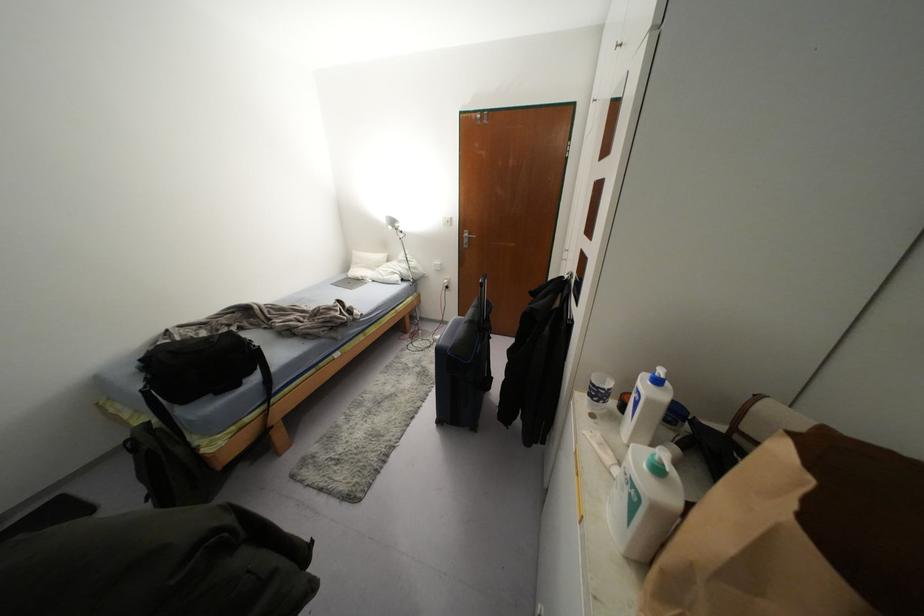
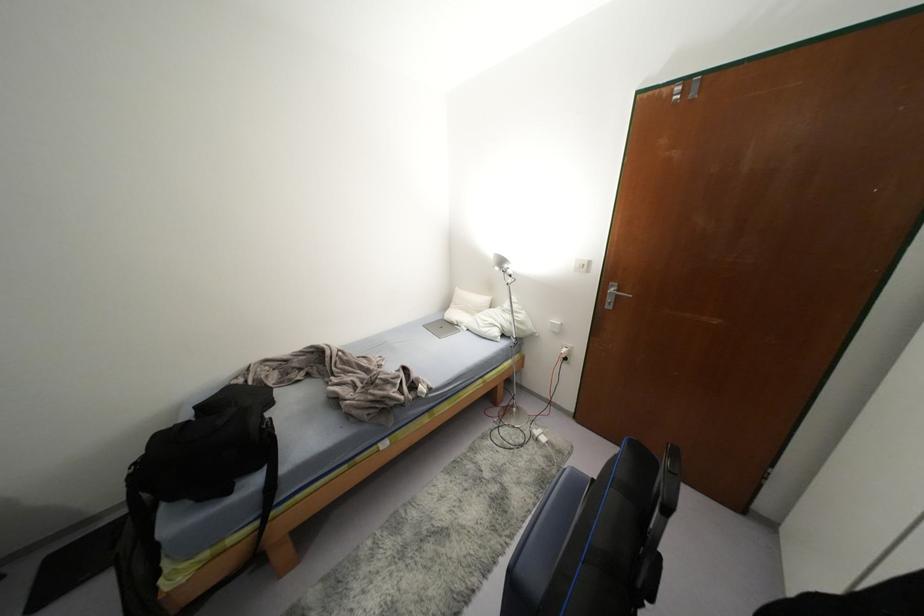
Question: The camera is either moving clockwise (left) or counter-clockwise (right) around the object. The first image is from the beginning of the video and the second image is from the end. Is the camera moving left or right when shooting the video?

Choices:
 (A) Left
 (B) Right

Answer: (B)